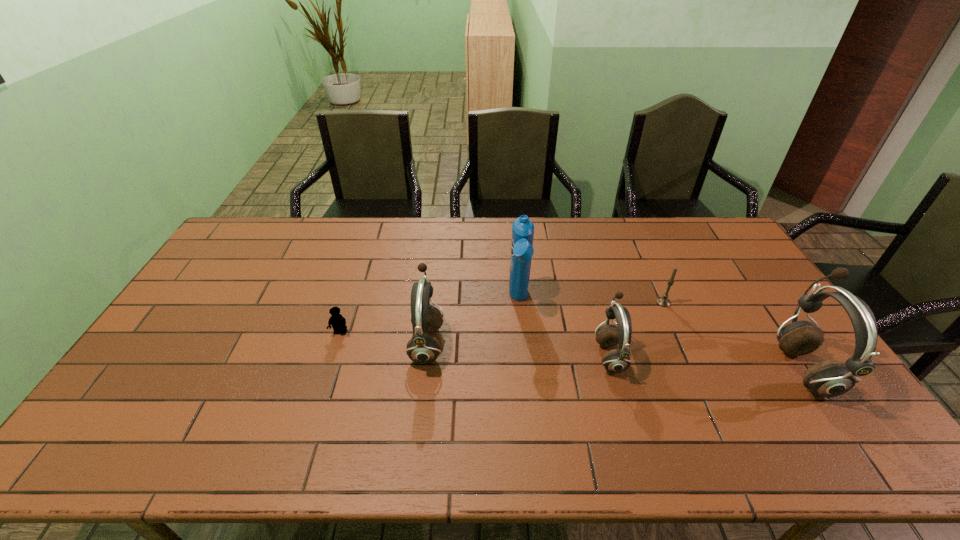
Locate an element on the screen. the second tallest earphone is located at coordinates (422, 348).

Find the location of a particular element. the fifth object from right to left is located at coordinates (422, 348).

Image resolution: width=960 pixels, height=540 pixels. Find the location of `the third object from right to left`. the third object from right to left is located at coordinates (618, 360).

Where is `the shortest earphone`? the shortest earphone is located at coordinates (618, 360).

Where is `the rightmost object`? Image resolution: width=960 pixels, height=540 pixels. the rightmost object is located at coordinates (830, 378).

Identify the location of the tallest earphone. point(830,378).

Identify the location of candle. The image size is (960, 540). (662, 301).

Where is `the fifth tallest object`? The image size is (960, 540). the fifth tallest object is located at coordinates (662, 301).

This screenshot has width=960, height=540. Identify the location of Lego. (337, 321).

The width and height of the screenshot is (960, 540). Identify the location of the leftmost object. (337, 321).